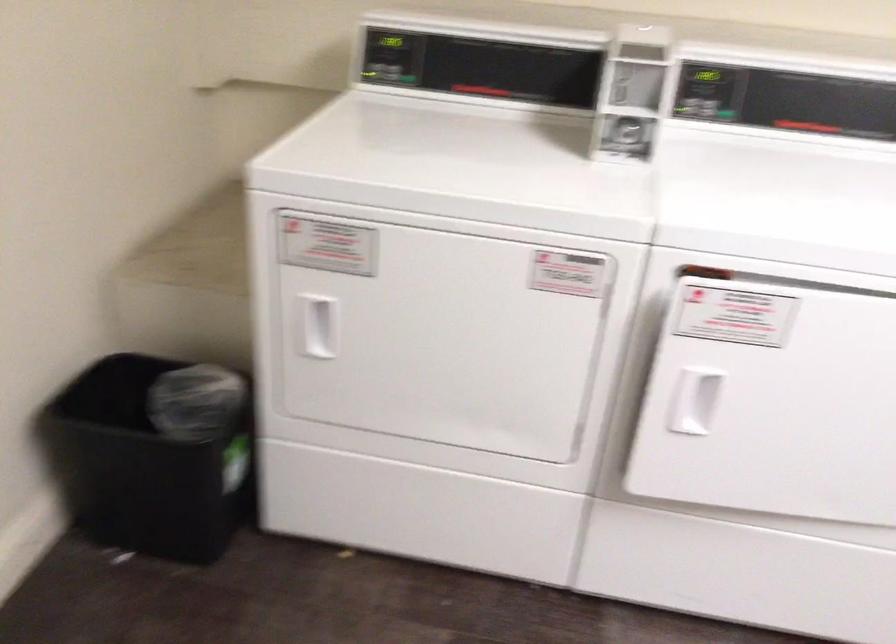
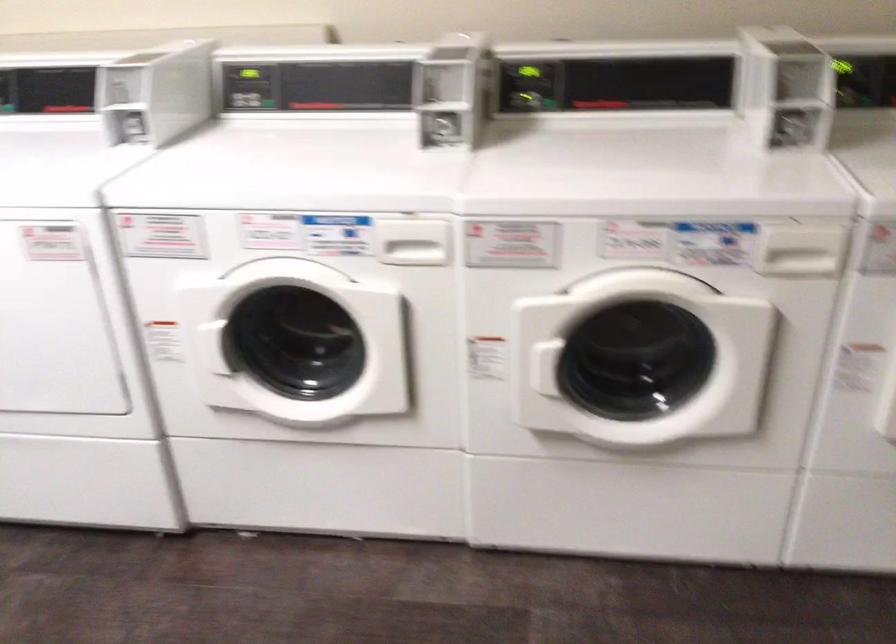
Question: What movement of the cameraman would produce the second image?

Choices:
 (A) Left
 (B) Right
 (C) Forward
 (D) Backward

Answer: (B)